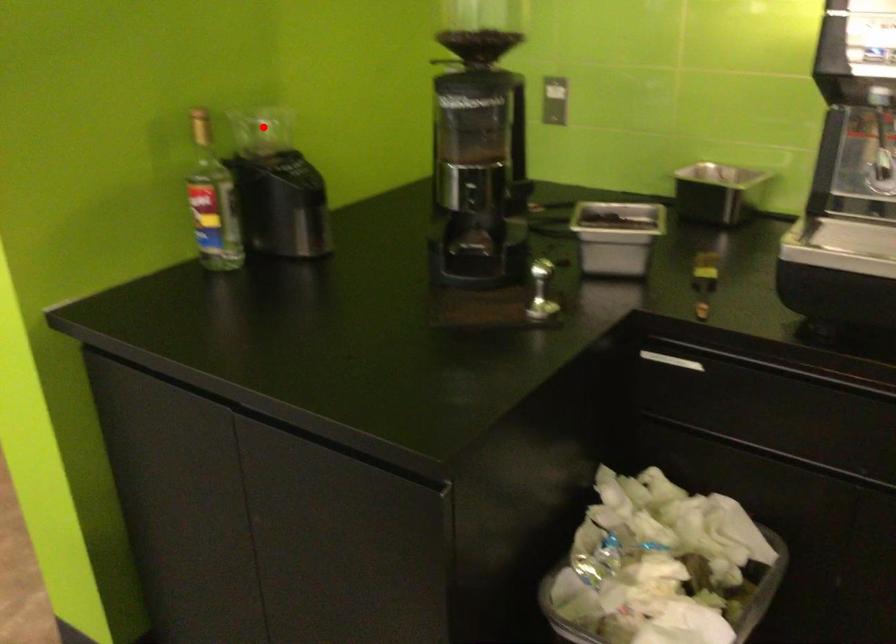
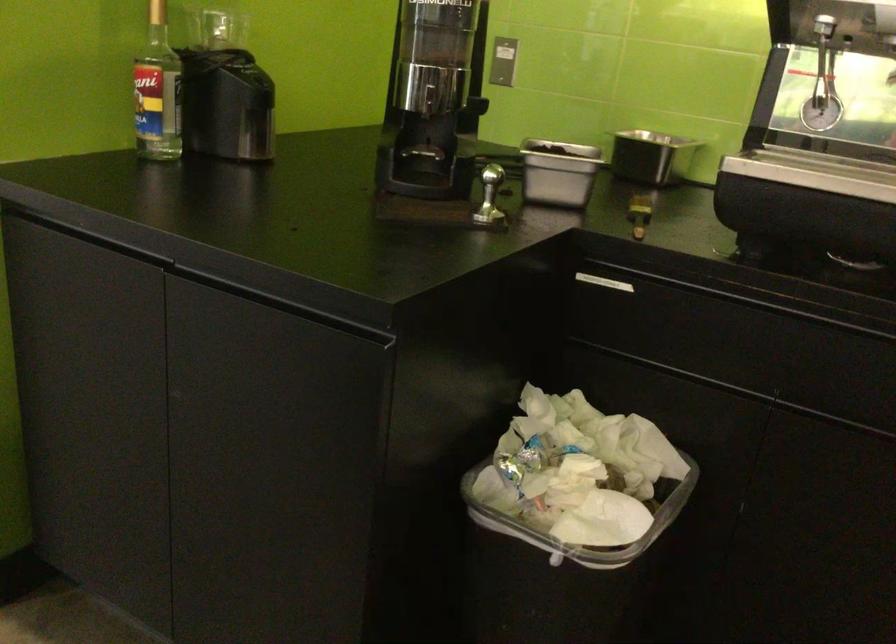
Find the pixel in the second image that matches the highlighted location in the first image.

(216, 29)